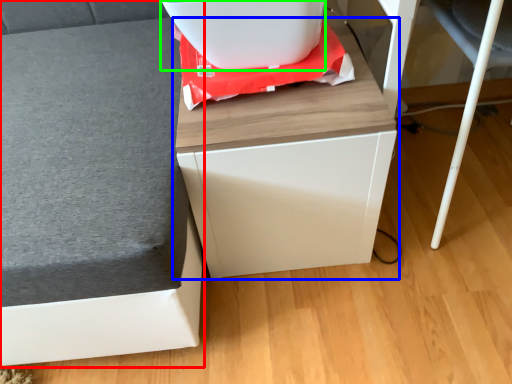
Question: Which object is the farthest from furniture (highlighted by a red box)? Choose among these: furniture (highlighted by a blue box) or appliance (highlighted by a green box).

Choices:
 (A) furniture
 (B) appliance

Answer: (B)